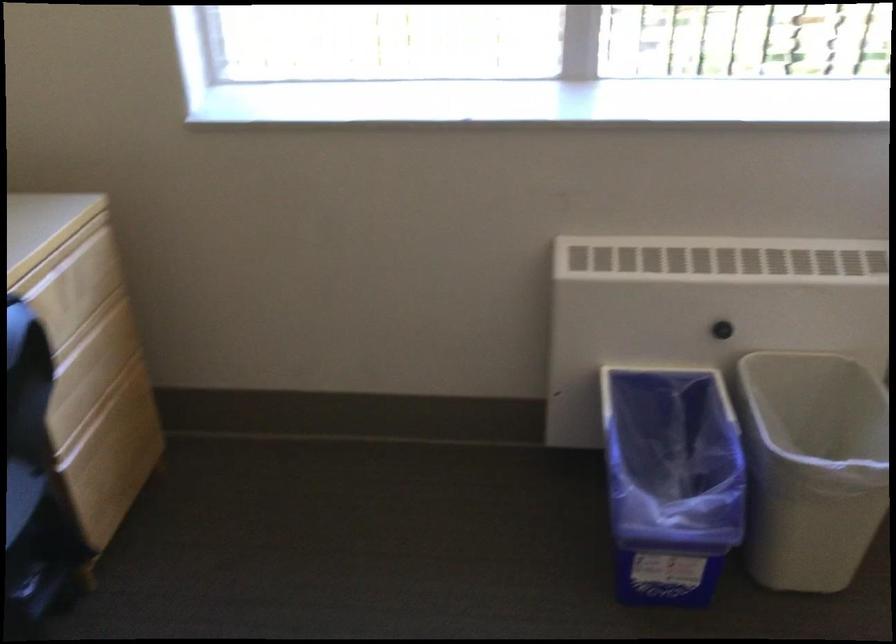
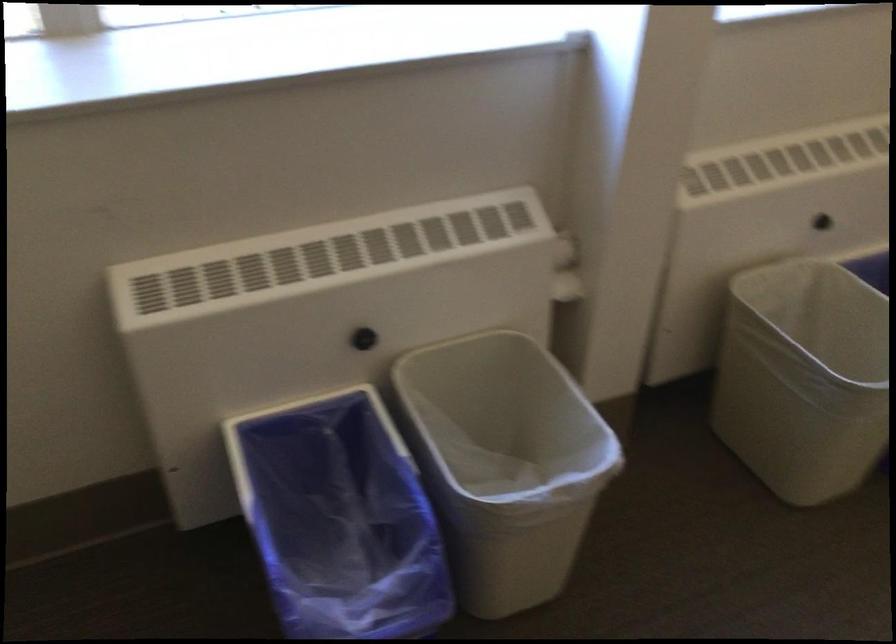
Question: The camera is either moving clockwise (left) or counter-clockwise (right) around the object. The first image is from the beginning of the video and the second image is from the end. Is the camera moving left or right when shooting the video?

Choices:
 (A) Left
 (B) Right

Answer: (A)